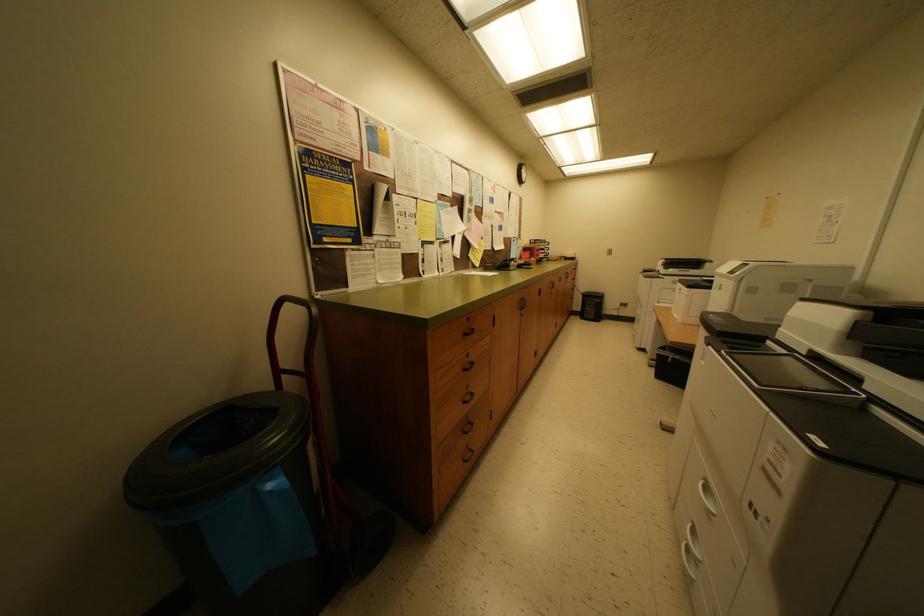
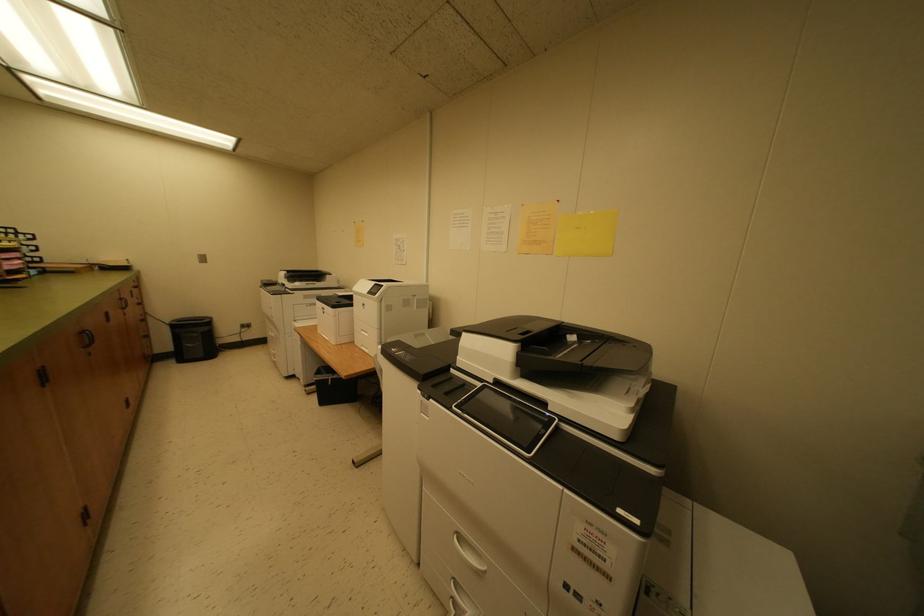
Question: Based on the continuous images, in which direction is the camera rotating? Reply with the corresponding letter.

Choices:
 (A) Left
 (B) Right
 (C) Up
 (D) Down

Answer: (B)